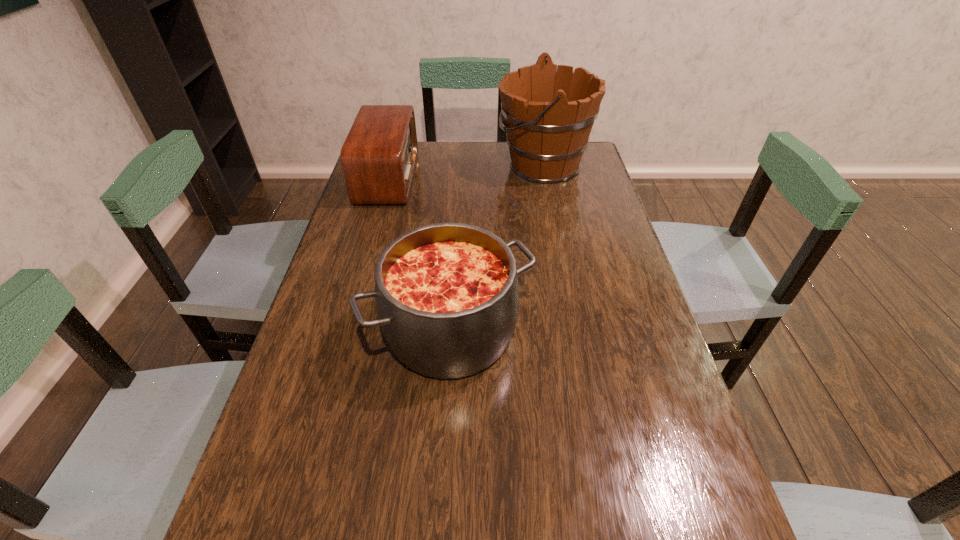
The height and width of the screenshot is (540, 960). I want to click on vacant space that satisfies the following two spatial constraints: 1. on the front panel of the nearest object; 2. on the right side of the radio receiver, so click(x=345, y=331).